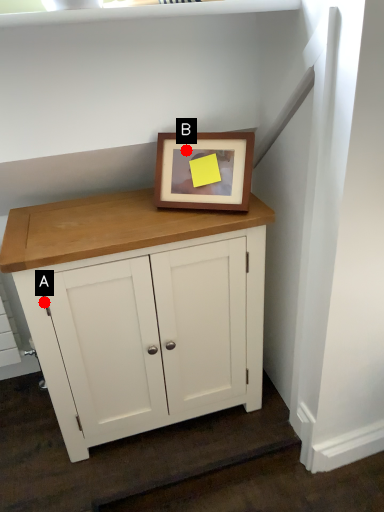
Question: Two points are circled on the image, labeled by A and B beside each circle. Which point is farther from the camera taking this photo?

Choices:
 (A) A is further
 (B) B is further

Answer: (B)